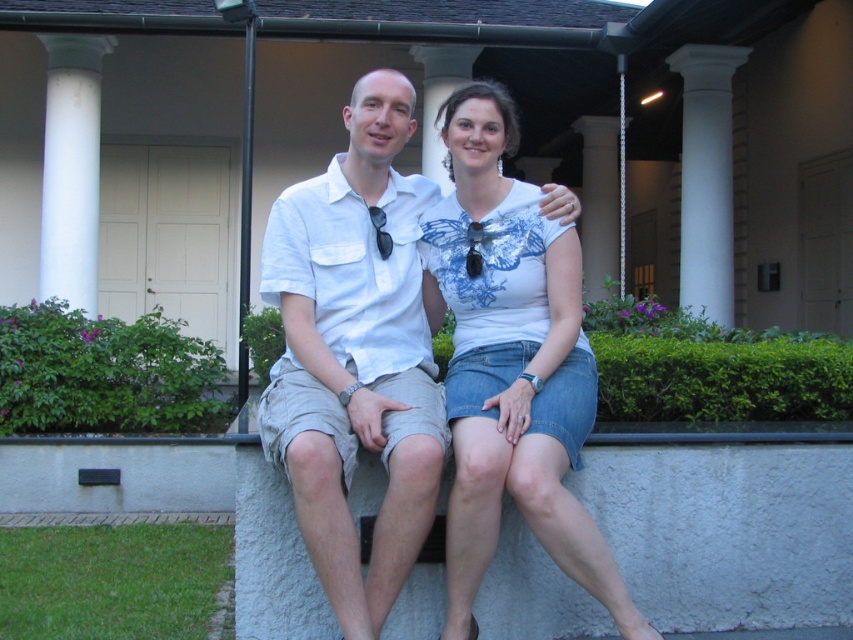
You are standing in front of the classical building and want to take a photo of both the white marble pillar at center and the white stone pillar at center. Which pillar should you focus on first if you want to capture them both in the frame?

The white marble pillar at center is located below the white stone pillar at center, so you should focus on the white marble pillar at center first to ensure both pillars are in the frame.

You are a photographer trying to capture a photo of the white cotton shirt at center and the white marble pillar at center. Which object should you focus on first if you want to include both in your frame without moving the camera?

You should focus on the white marble pillar at center first because it is larger than the white cotton shirt at center, ensuring it fits well within the frame.

You are standing in front of the classical building and see the point marked at coordinates (599, 202). What is this point located on?

The point at (599, 202) is located on the white marble pillar at center.